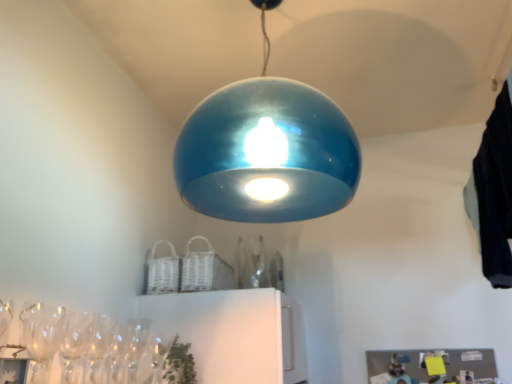
What do you see at coordinates (494, 193) in the screenshot?
I see `dark blue fabric at upper right` at bounding box center [494, 193].

What is the approximate width of dark blue fabric at upper right?

It is 7.72 inches.

What do you see at coordinates (267, 151) in the screenshot? I see `glossy blue dome at center` at bounding box center [267, 151].

Find the location of a particular element. This screenshot has height=384, width=512. dark blue fabric at upper right is located at coordinates (494, 193).

Is dark blue fabric at upper right far from clear glass wine glass at lower left?

Yes, dark blue fabric at upper right and clear glass wine glass at lower left are quite far apart.

Is dark blue fabric at upper right spatially inside clear glass wine glass at lower left, or outside of it?

dark blue fabric at upper right is outside clear glass wine glass at lower left.

Based on the photo, is dark blue fabric at upper right smaller than clear glass wine glass at lower left?

No, dark blue fabric at upper right is not smaller than clear glass wine glass at lower left.

Can you confirm if dark blue fabric at upper right is wider than clear glass wine glass at lower left?

Yes, dark blue fabric at upper right is wider than clear glass wine glass at lower left.

Which point is more distant from viewer, (132,378) or (478,230)?

The point (478,230) is farther from the camera.

Which of these two, clear glass wine glass at lower left or dark blue fabric at upper right, is wider?

dark blue fabric at upper right is wider.

From a real-world perspective, is clear glass wine glass at lower left physically located above or below dark blue fabric at upper right?

From a real-world perspective, clear glass wine glass at lower left is physically below dark blue fabric at upper right.

Is clear glass wine glass at lower left taller than dark blue fabric at upper right?

In fact, clear glass wine glass at lower left may be shorter than dark blue fabric at upper right.

From a real-world perspective, is dark blue fabric at upper right under glossy blue dome at center?

Yes.

Is dark blue fabric at upper right at the left side of glossy blue dome at center?

No.

Are dark blue fabric at upper right and glossy blue dome at center making contact?

dark blue fabric at upper right and glossy blue dome at center are not in contact.

How many degrees apart are the facing directions of glossy blue dome at center and clear glass wine glass at lower left?

1.6 degrees separate the facing orientations of glossy blue dome at center and clear glass wine glass at lower left.

Based on their positions, is glossy blue dome at center located to the left or right of clear glass wine glass at lower left?

Clearly, glossy blue dome at center is on the right of clear glass wine glass at lower left in the image.

Looking at this image, considering the sizes of objects glossy blue dome at center and clear glass wine glass at lower left in the image provided, who is smaller, glossy blue dome at center or clear glass wine glass at lower left?

clear glass wine glass at lower left is smaller.

Could you tell me if glossy blue dome at center is facing clear glass wine glass at lower left?

No, glossy blue dome at center is not oriented towards clear glass wine glass at lower left.

Is glossy blue dome at center smaller than dark blue fabric at upper right?

Actually, glossy blue dome at center might be larger than dark blue fabric at upper right.

Image resolution: width=512 pixels, height=384 pixels. Identify the location of lamp that is above the dark blue fabric at upper right (from a real-world perspective). (267, 151).

Is glossy blue dome at center directly adjacent to dark blue fabric at upper right?

No, glossy blue dome at center is not making contact with dark blue fabric at upper right.

Is glossy blue dome at center further to the viewer compared to dark blue fabric at upper right?

No, glossy blue dome at center is closer to the viewer.

Which of these two, clear glass wine glass at lower left or glossy blue dome at center, is smaller?

With smaller size is clear glass wine glass at lower left.

From a real-world perspective, is clear glass wine glass at lower left on glossy blue dome at center?

No, from a real-world perspective, clear glass wine glass at lower left is not above glossy blue dome at center.

From the image's perspective, is clear glass wine glass at lower left located above or below glossy blue dome at center?

Based on their image positions, clear glass wine glass at lower left is located beneath glossy blue dome at center.

Image resolution: width=512 pixels, height=384 pixels. What are the coordinates of `laundry on the right of the clear glass wine glass at lower left` in the screenshot? It's located at (494, 193).

Where is `wine glass to the left of dark blue fabric at upper right`? The width and height of the screenshot is (512, 384). wine glass to the left of dark blue fabric at upper right is located at coordinates (136, 345).

Which object lies nearer to the anchor point glossy blue dome at center, dark blue fabric at upper right or clear glass wine glass at lower left?

Among the two, dark blue fabric at upper right is located nearer to glossy blue dome at center.

Based on their spatial positions, is dark blue fabric at upper right or glossy blue dome at center closer to clear glass wine glass at lower left?

The object closer to clear glass wine glass at lower left is glossy blue dome at center.

When comparing their distances from dark blue fabric at upper right, does clear glass wine glass at lower left or glossy blue dome at center seem closer?

Based on the image, glossy blue dome at center appears to be nearer to dark blue fabric at upper right.

Looking at this image, estimate the real-world distances between objects in this image. Which object is closer to glossy blue dome at center, clear glass wine glass at lower left or dark blue fabric at upper right?

dark blue fabric at upper right is closer to glossy blue dome at center.

Based on their spatial positions, is glossy blue dome at center or dark blue fabric at upper right closer to clear glass wine glass at lower left?

Based on the image, glossy blue dome at center appears to be nearer to clear glass wine glass at lower left.

Considering their positions, is glossy blue dome at center positioned closer to dark blue fabric at upper right than clear glass wine glass at lower left?

Based on the image, glossy blue dome at center appears to be nearer to dark blue fabric at upper right.

Identify the location of lamp between clear glass wine glass at lower left and dark blue fabric at upper right. (267, 151).